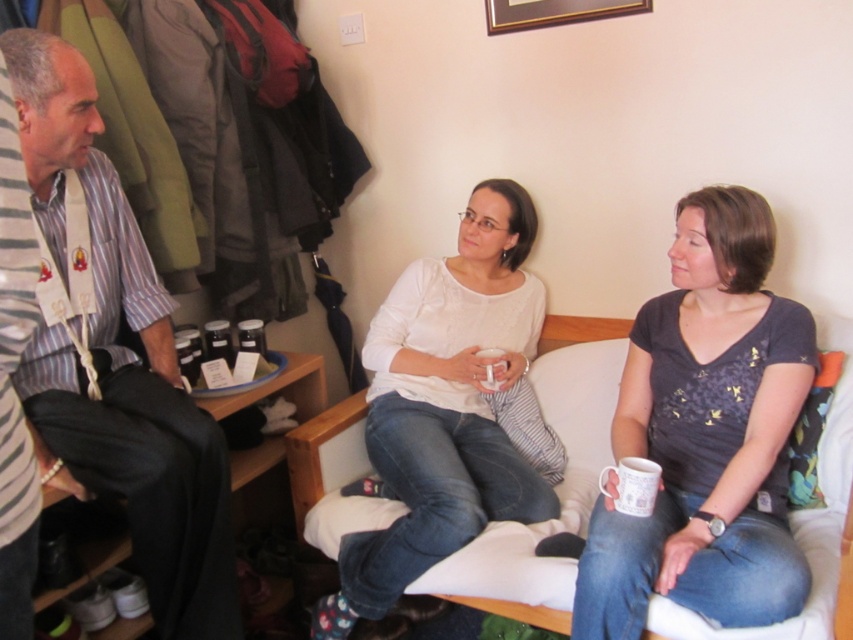
You are organizing a clothing donation drive and need to determine which of the two shirts, the striped cotton shirt at left or the white matte shirt at center, can fit into a donation box that has a width capacity of 40 cm. Given their widths, which shirt is more likely to fit?

The striped cotton shirt at left has a lesser width compared to the white matte shirt at center, so the striped cotton shirt at left is more likely to fit into the donation box with a 40 cm width capacity.

You are a photographer setting up for a group photo. You have a camera with a 24cm wide frame. The matte gray shirt at center and striped cotton shirt at left are the main subjects. Can both shirts fit within the frame if positioned side by side?

The matte gray shirt at center might be wider than striped cotton shirt at left, so combined their total width could exceed the 24cm frame. Check their exact widths before positioning.